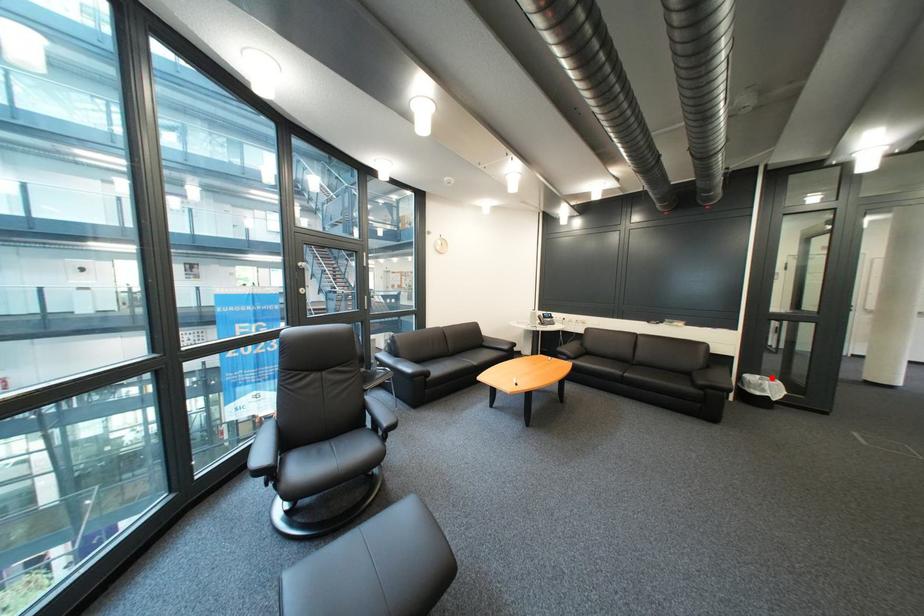
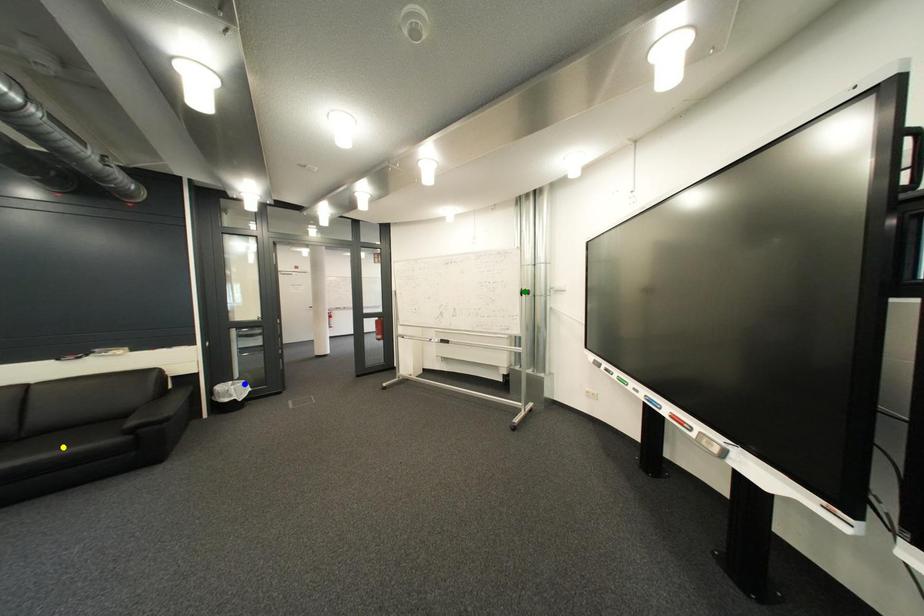
Question: I am providing you with two images of the same scene from different viewpoints. A red point is marked on the first image. You are given multiple points on the second image. In image 2, which mark is for the same physical point as the one in image 1?

Choices:
 (A) yellow point
 (B) green point
 (C) blue point

Answer: (C)